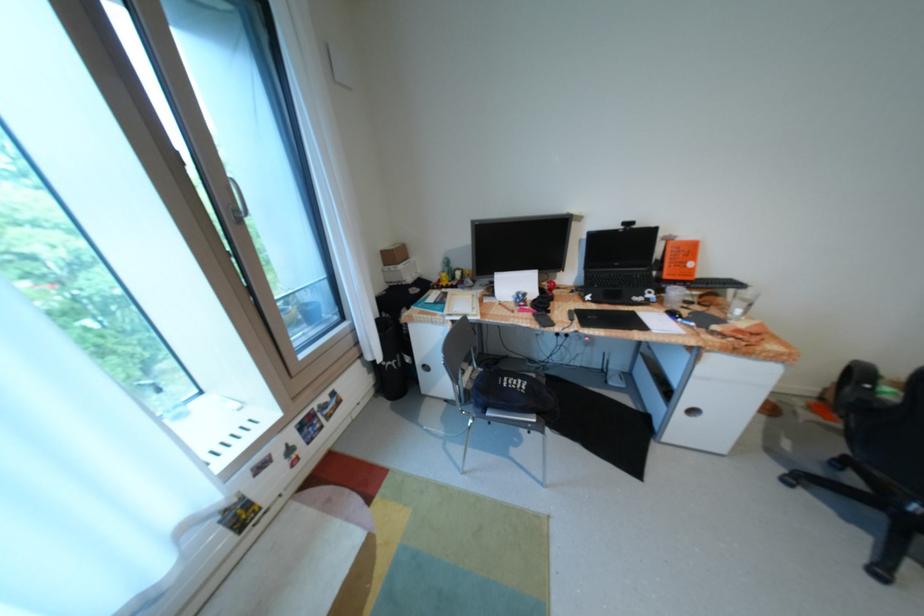
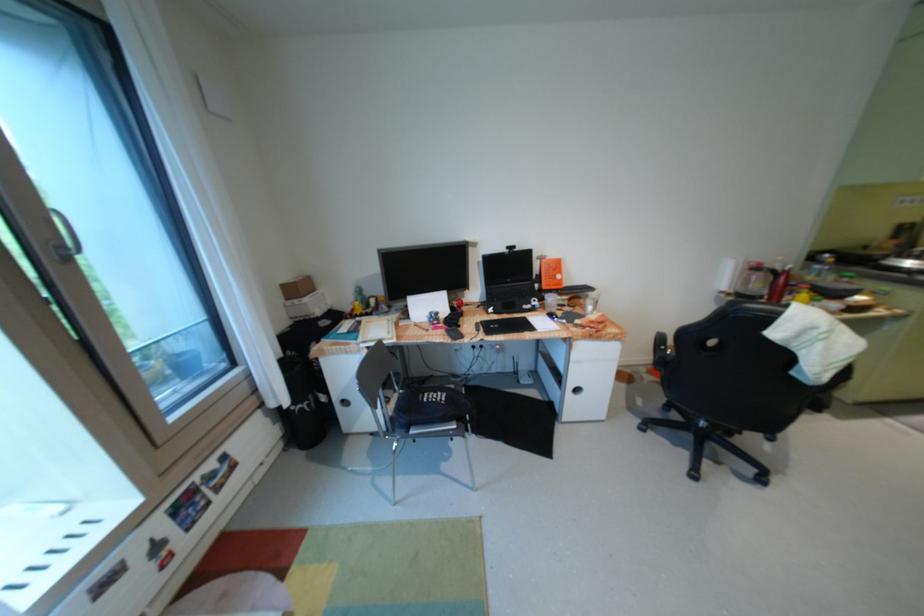
Locate, in the second image, the point that corresponds to pixel 624 225 in the first image.

(512, 249)